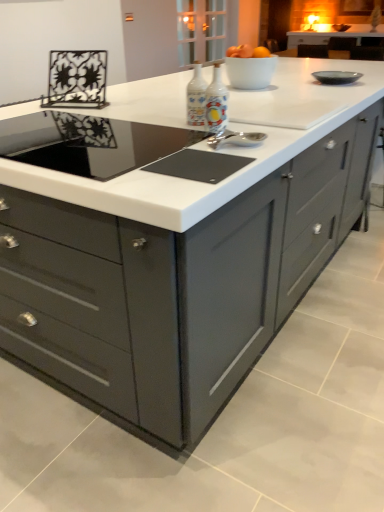
This screenshot has height=512, width=384. Find the location of `vacant space situated on the left part of porcelain bottles at center, which is the second appliance from left to right`. vacant space situated on the left part of porcelain bottles at center, which is the second appliance from left to right is located at coordinates (172, 129).